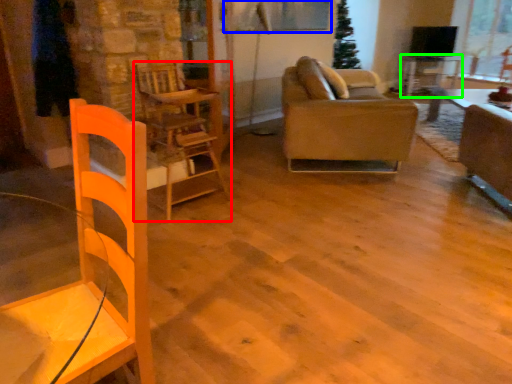
Question: Which object is positioned closest to chair (highlighted by a red box)? Select from window screen (highlighted by a blue box) and table (highlighted by a green box).

Choices:
 (A) window screen
 (B) table

Answer: (A)